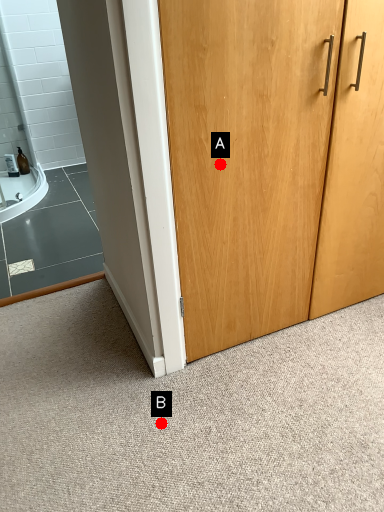
Question: Two points are circled on the image, labeled by A and B beside each circle. Among these points, which one is nearest to the camera?

Choices:
 (A) A is closer
 (B) B is closer

Answer: (A)